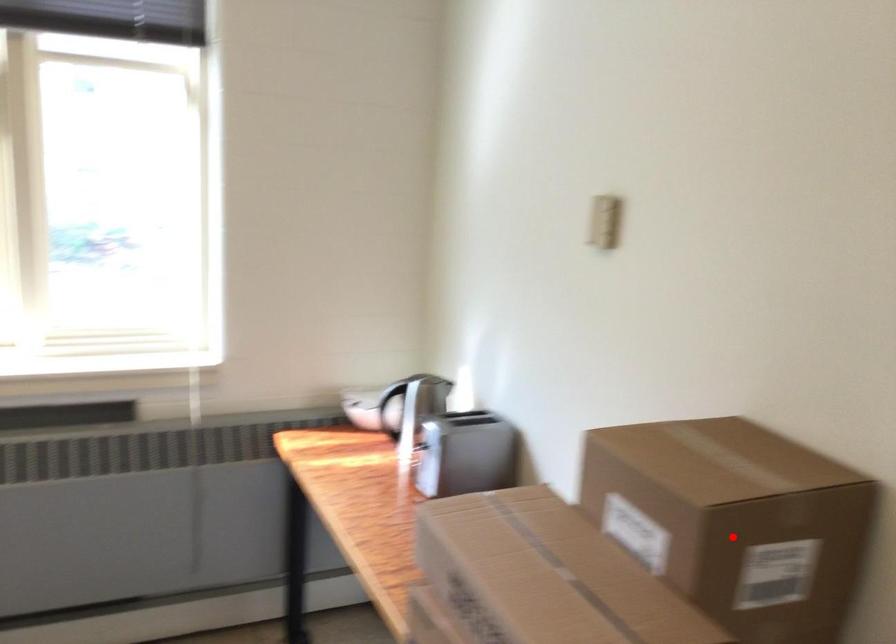
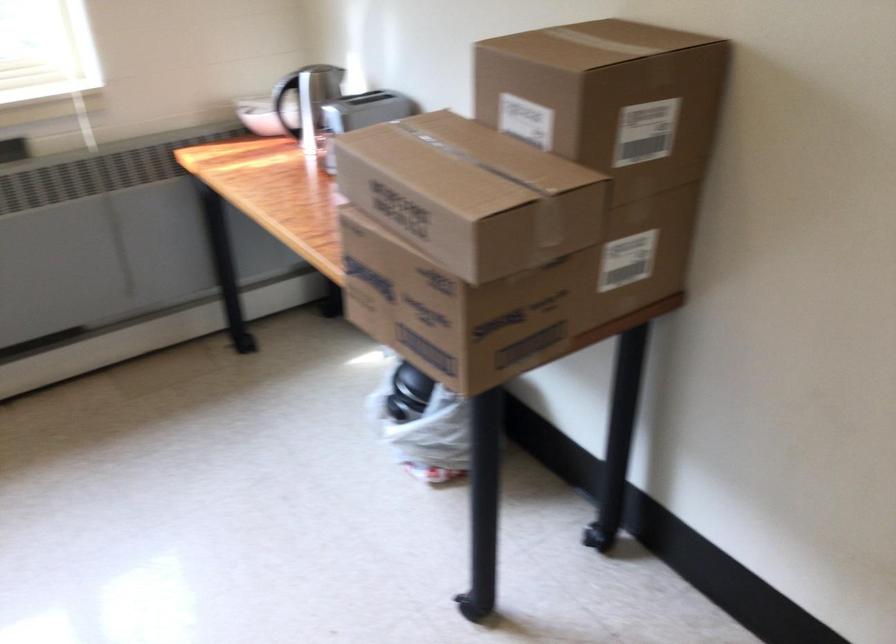
Question: I am providing you with two images of the same scene from different viewpoints. Given a red point in image1, look at the same physical point in image2. Is it:

Choices:
 (A) Closer to the viewpoint
 (B) Farther from the viewpoint

Answer: (B)